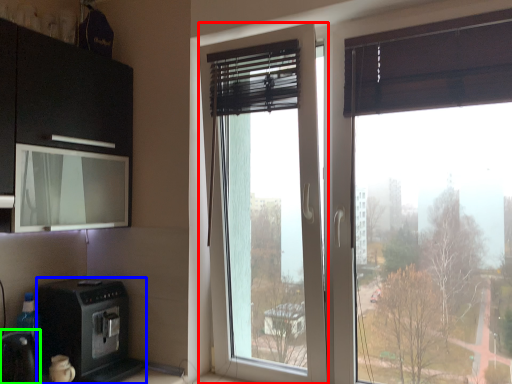
Question: Based on their relative distances, which object is nearer to window (highlighted by a red box)? Choose from home appliance (highlighted by a blue box) and appliance (highlighted by a green box).

Choices:
 (A) home appliance
 (B) appliance

Answer: (A)